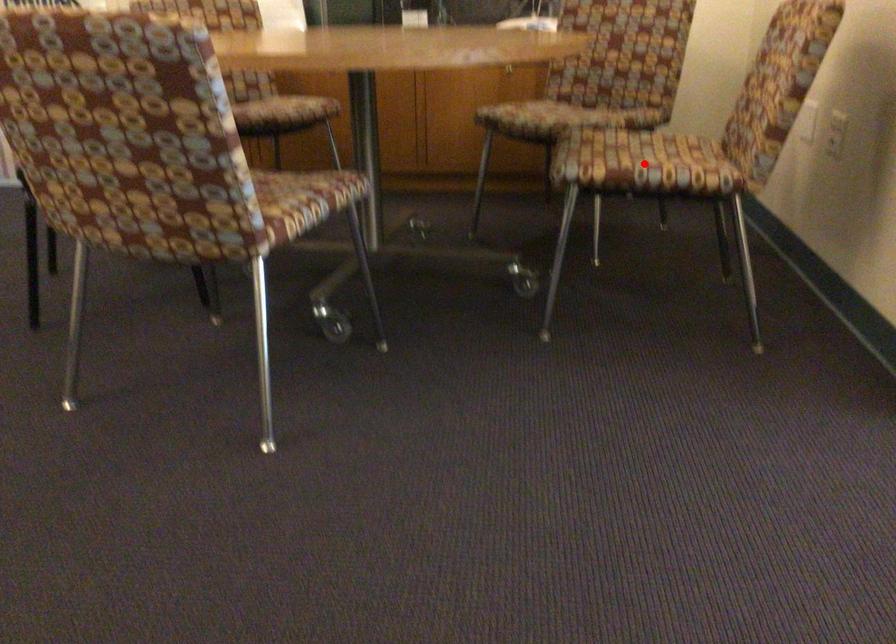
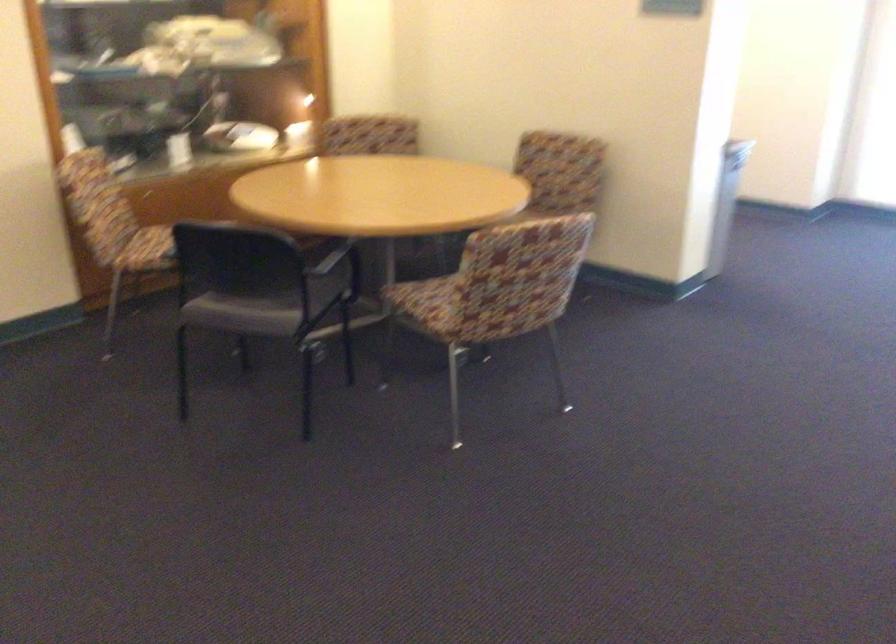
Question: I am providing you with two images of the same scene from different viewpoints. A red point is marked on the first image. Is the red point's position out of view in image 2?

Choices:
 (A) Yes
 (B) No

Answer: (A)